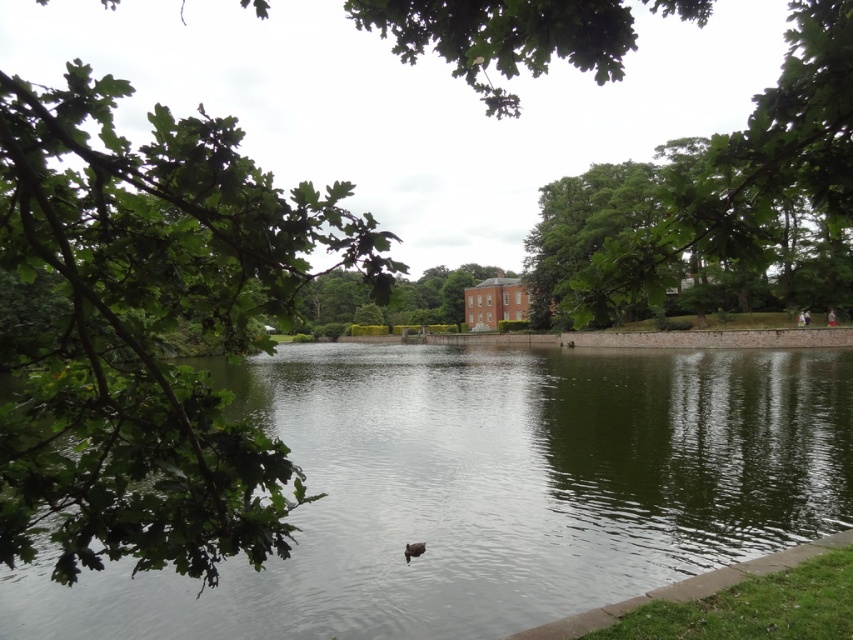
Is green leafy branch at left thinner than green leafy tree at center?

Indeed, green leafy branch at left has a lesser width compared to green leafy tree at center.

Which is above, green leafy branch at left or green leafy tree at center?

green leafy tree at center

You are a GUI agent. You are given a task and a screenshot of the screen. Output one action in this format:
    pyautogui.click(x=<x>, y=<y>)
    Task: Click on the green leafy branch at left
    This screenshot has width=853, height=640.
    Given the screenshot: What is the action you would take?
    pyautogui.click(x=146, y=330)

Does green leafy branch at left have a greater width compared to brown fuzzy duck at center?

Correct, the width of green leafy branch at left exceeds that of brown fuzzy duck at center.

Is green leafy branch at left behind brown fuzzy duck at center?

No, it is in front of brown fuzzy duck at center.

At what (x,y) coordinates should I click in order to perform the action: click on green leafy branch at left. Please return your answer as a coordinate pair (x, y). The height and width of the screenshot is (640, 853). Looking at the image, I should click on (146, 330).

Who is more forward, (849, 472) or (364, 298)?

Point (849, 472) is in front.

Which is above, green reflective water at center or green leafy tree at center?

green leafy tree at center

Between point (155, 577) and point (306, 323), which one is positioned behind?

The point (306, 323) is behind.

I want to click on green reflective water at center, so click(492, 490).